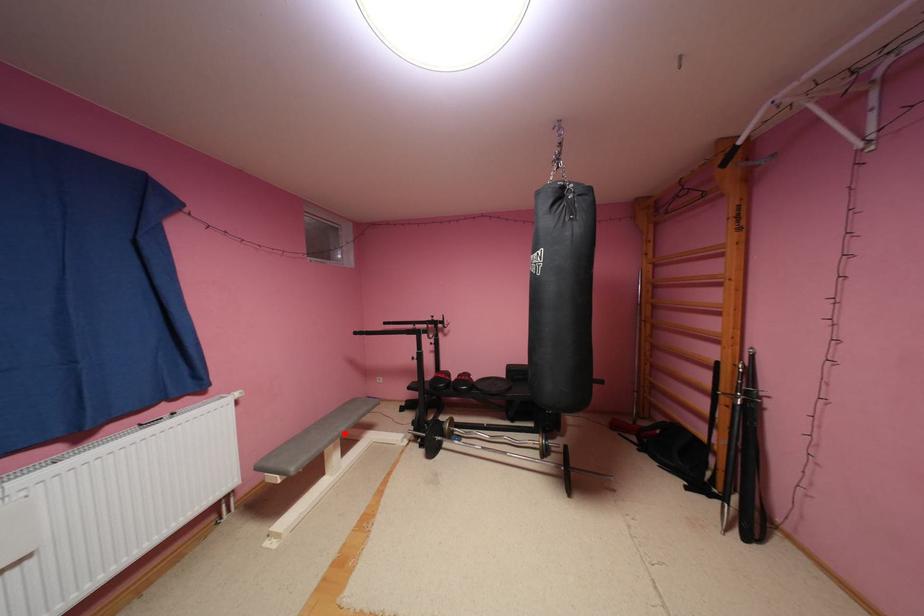
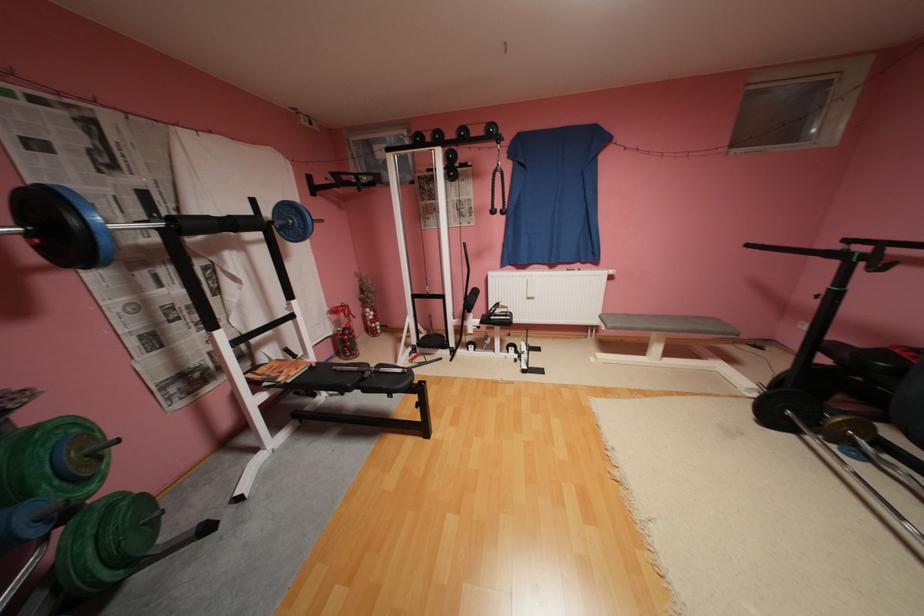
Question: I am providing you with two images of the same scene from different viewpoints. A red point is shown in image1. For the corresponding object point in image2, is it positioned nearer or farther from the camera?

Choices:
 (A) Nearer
 (B) Farther

Answer: (B)